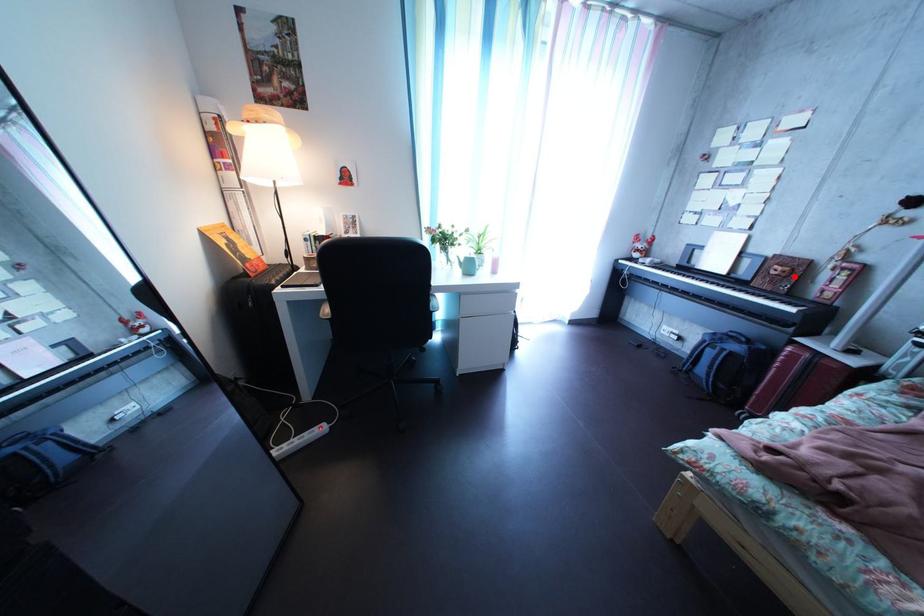
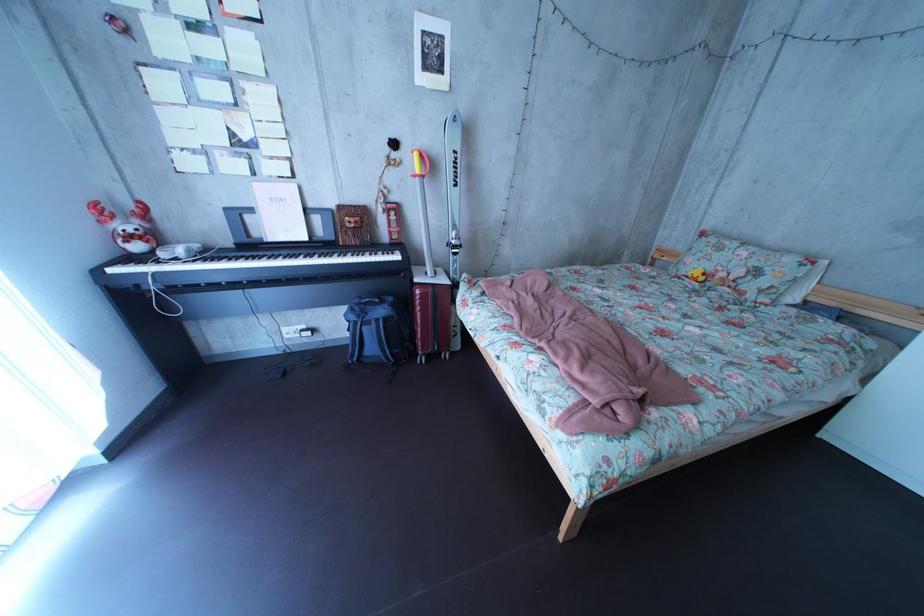
Where in the second image is the point corresponding to the highlighted location from the first image?

(367, 228)